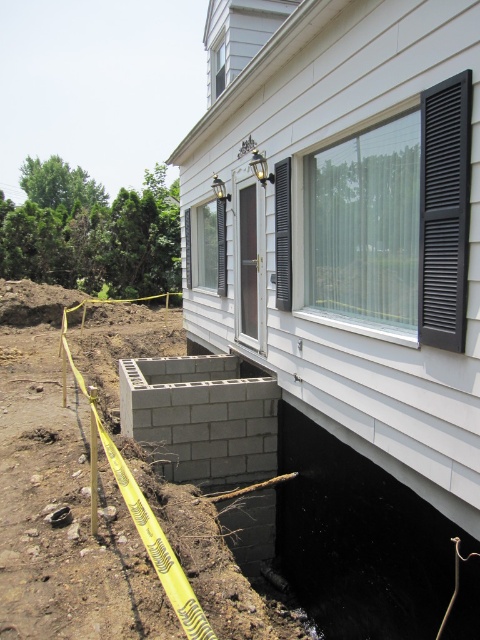
You are a construction worker standing at the point marked by coordinates point (201,417). You need to move to the glass door on the porch. Which direction should you walk to avoid the excavated area?

The point (201,417) corresponds to the gray concrete block at lower center. To reach the glass door on the porch while avoiding the excavated area, you should walk towards the upper right direction away from the gray concrete block at lower center.

You are a construction worker who needs to place a new support beam. You see the white siding at center and the gray concrete block at lower center. Which object should you avoid placing the beam near to ensure it doesn

The white siding at center is positioned on the right side of the gray concrete block at lower center. Since the concrete block is part of the foundation structure, placing the beam near the gray concrete block at lower center would be more stable and avoid damaging the siding.